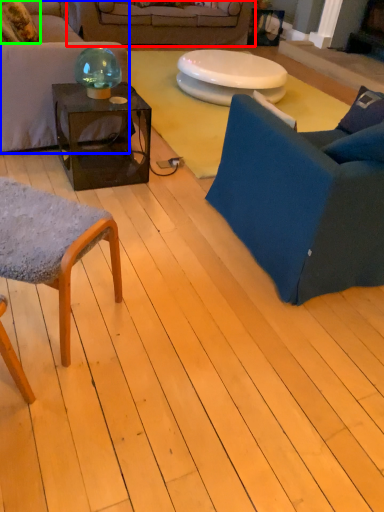
Question: Which is farther away from studio couch (highlighted by a red box)? studio couch (highlighted by a blue box) or pillow (highlighted by a green box)?

Choices:
 (A) studio couch
 (B) pillow

Answer: (A)